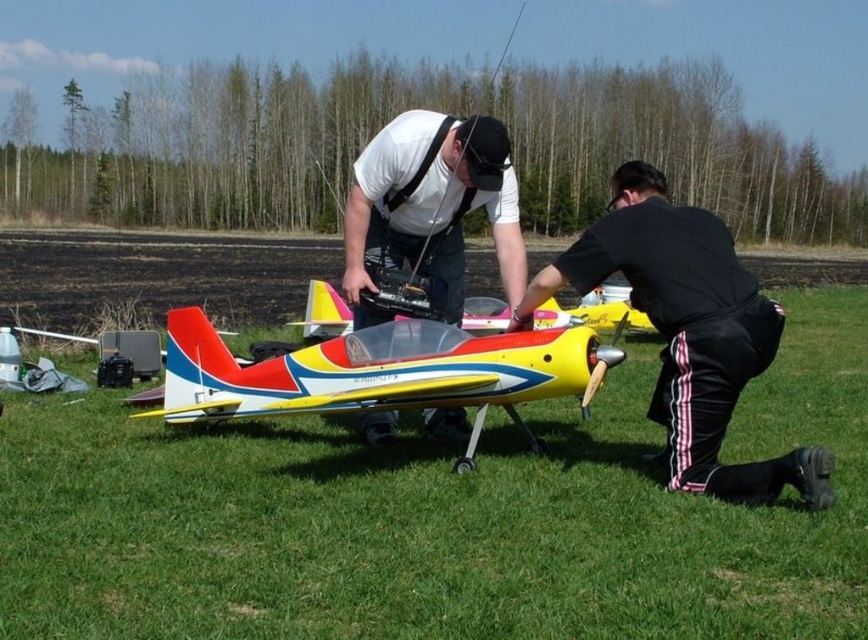
Based on the photo, is green grass at lower center thinner than black matte pants at lower right?

Yes, green grass at lower center is thinner than black matte pants at lower right.

Does point (300, 595) come farther from viewer compared to point (635, 189)?

No, it is in front of (635, 189).

What do you see at coordinates (439, 516) in the screenshot? I see `green grass at lower center` at bounding box center [439, 516].

Identify the location of green grass at lower center. (439, 516).

Looking at this image, which of these two, black matte pants at lower right or matte white shirt at center, stands shorter?

black matte pants at lower right

Image resolution: width=868 pixels, height=640 pixels. I want to click on black matte pants at lower right, so click(x=688, y=332).

Is point (698, 355) closer to viewer compared to point (455, 154)?

Yes, point (698, 355) is in front of point (455, 154).

At what (x,y) coordinates should I click in order to perform the action: click on black matte pants at lower right. Please return your answer as a coordinate pair (x, y). Looking at the image, I should click on (688, 332).

Which is more to the right, shiny plastic airplane at center or matte white shirt at center?

matte white shirt at center

Consider the image. Is shiny plastic airplane at center further to the viewer compared to matte white shirt at center?

No.

Locate an element on the screen. Image resolution: width=868 pixels, height=640 pixels. shiny plastic airplane at center is located at coordinates (380, 372).

This screenshot has width=868, height=640. In order to click on shiny plastic airplane at center in this screenshot , I will do `click(380, 372)`.